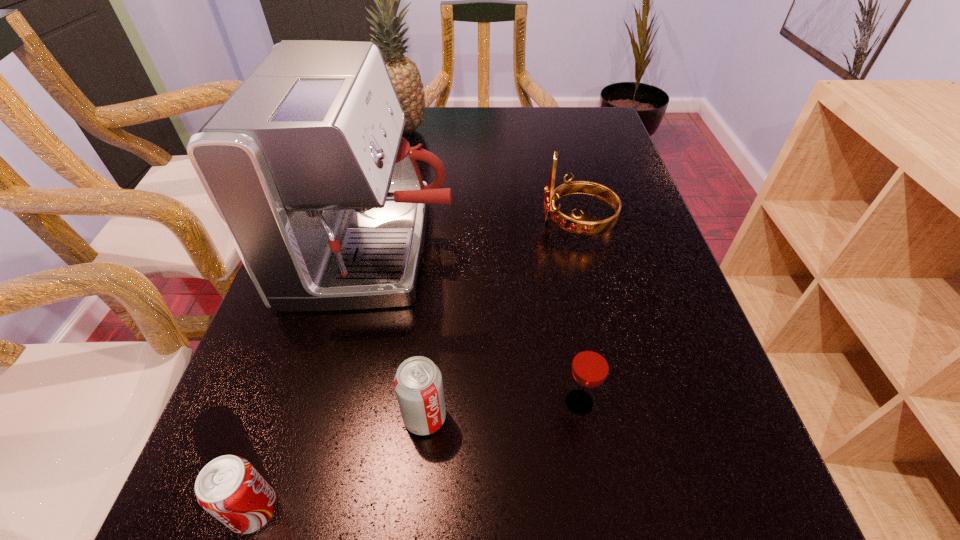
The width and height of the screenshot is (960, 540). What are the coordinates of `object that is at the right edge` in the screenshot? It's located at (575, 225).

Locate an element on the screen. object that is at the far left corner is located at coordinates coord(405,76).

Identify the location of object at the near left corner. (229, 488).

This screenshot has width=960, height=540. In the image, there is a desktop. In order to click on vacant space at the far edge in this screenshot , I will do [x=457, y=109].

Find the location of `vacant space at the left edge`. vacant space at the left edge is located at coordinates (304, 397).

Locate an element on the screen. This screenshot has width=960, height=540. free space at the right edge of the desktop is located at coordinates (644, 450).

Image resolution: width=960 pixels, height=540 pixels. Identify the location of vacant space at the far right corner. (595, 137).

Identify the location of vacant space that's between the coffee maker and the left soda can. The image size is (960, 540). (315, 380).

The width and height of the screenshot is (960, 540). What are the coordinates of `free spot between the coffee maker and the right soda can` in the screenshot? It's located at (400, 333).

Where is `vacant region between the coffee maker and the glass`? vacant region between the coffee maker and the glass is located at coordinates (477, 326).